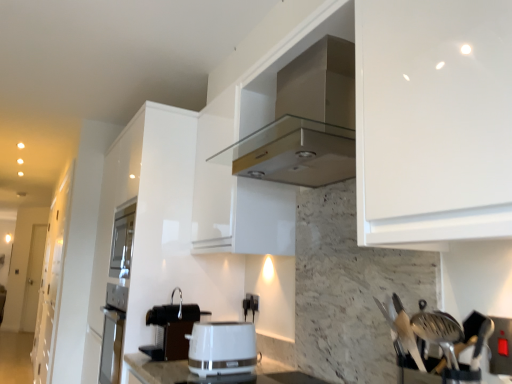
Question: Can you confirm if black plastic coffee machine at lower center is smaller than white glossy cabinet at left?

Choices:
 (A) no
 (B) yes

Answer: (B)

Question: Is black plastic coffee machine at lower center positioned with its back to white glossy cabinet at left?

Choices:
 (A) no
 (B) yes

Answer: (A)

Question: From a real-world perspective, is black plastic coffee machine at lower center over white glossy cabinet at left?

Choices:
 (A) no
 (B) yes

Answer: (A)

Question: From a real-world perspective, is black plastic coffee machine at lower center located beneath white glossy cabinet at left?

Choices:
 (A) yes
 (B) no

Answer: (A)

Question: From the image's perspective, is black plastic coffee machine at lower center on top of white glossy cabinet at left?

Choices:
 (A) yes
 (B) no

Answer: (A)

Question: Considering the positions of point (59, 215) and point (245, 296), is point (59, 215) closer or farther from the camera than point (245, 296)?

Choices:
 (A) closer
 (B) farther

Answer: (B)

Question: Considering their positions, is white glossy cabinet at left located in front of or behind black plastic electric outlet at center?

Choices:
 (A) front
 (B) behind

Answer: (B)

Question: Do you think white glossy cabinet at left is within black plastic electric outlet at center, or outside of it?

Choices:
 (A) inside
 (B) outside

Answer: (B)

Question: In terms of size, does white glossy cabinet at left appear bigger or smaller than black plastic electric outlet at center?

Choices:
 (A) small
 (B) big

Answer: (B)

Question: Is black plastic electric outlet at center taller or shorter than white glossy toaster at center?

Choices:
 (A) tall
 (B) short

Answer: (B)

Question: From a real-world perspective, is black plastic electric outlet at center positioned above or below white glossy toaster at center?

Choices:
 (A) below
 (B) above

Answer: (B)

Question: Considering the positions of black plastic electric outlet at center and white glossy toaster at center in the image, is black plastic electric outlet at center bigger or smaller than white glossy toaster at center?

Choices:
 (A) small
 (B) big

Answer: (A)

Question: Do you think black plastic electric outlet at center is within white glossy toaster at center, or outside of it?

Choices:
 (A) inside
 (B) outside

Answer: (B)

Question: From a real-world perspective, relative to white glossy cabinet at left, is metallic silver utensils at right vertically above or below?

Choices:
 (A) above
 (B) below

Answer: (A)

Question: Considering the positions of metallic silver utensils at right and white glossy cabinet at left in the image, is metallic silver utensils at right bigger or smaller than white glossy cabinet at left?

Choices:
 (A) small
 (B) big

Answer: (A)